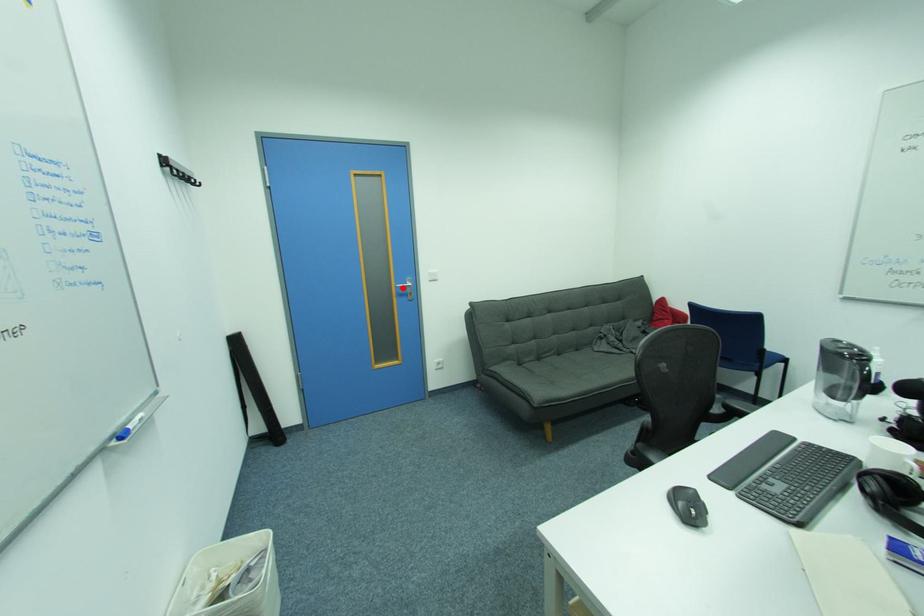
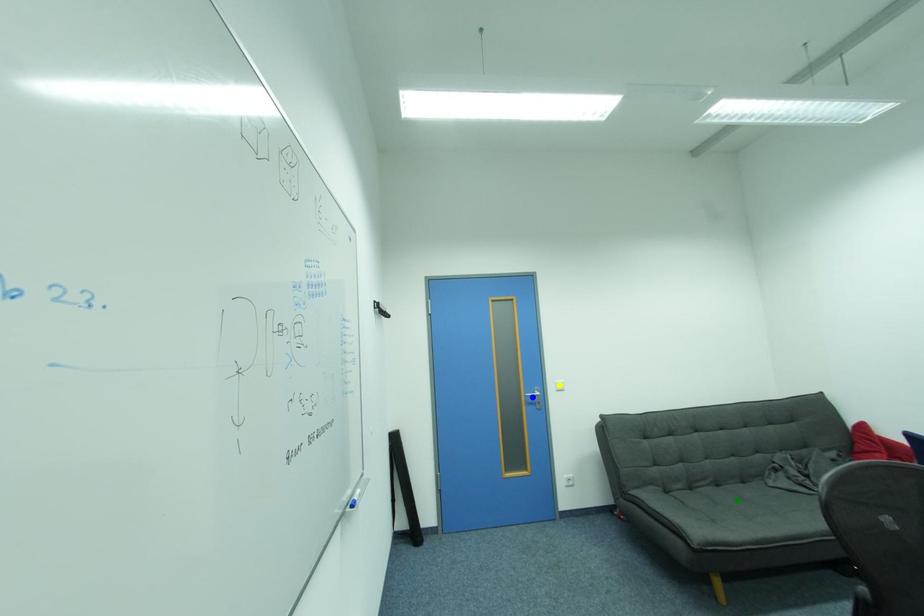
Question: I am providing you with two images of the same scene from different viewpoints. A red point is marked on the first image. You are given multiple points on the second image. Which spot in image 2 lines up with the point in image 1?

Choices:
 (A) green point
 (B) blue point
 (C) yellow point

Answer: (B)